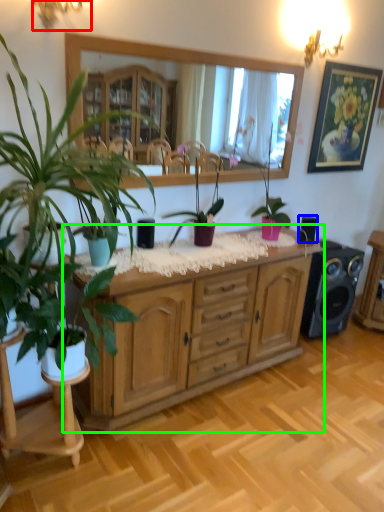
Question: Considering the real-world distances, which object is closest to lamp (highlighted by a red box)? speaker (highlighted by a blue box) or cabinetry (highlighted by a green box).

Choices:
 (A) speaker
 (B) cabinetry

Answer: (B)